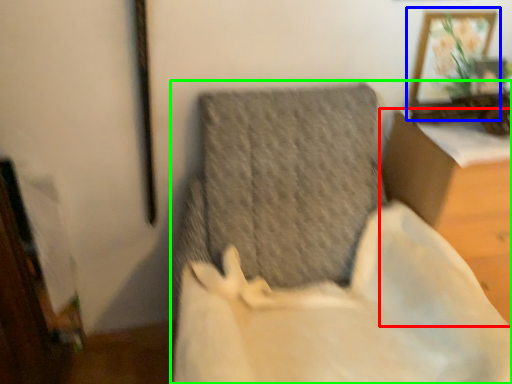
Question: Which object is the farthest from furniture (highlighted by a red box)? Choose among these: picture frame (highlighted by a blue box) or furniture (highlighted by a green box).

Choices:
 (A) picture frame
 (B) furniture

Answer: (B)